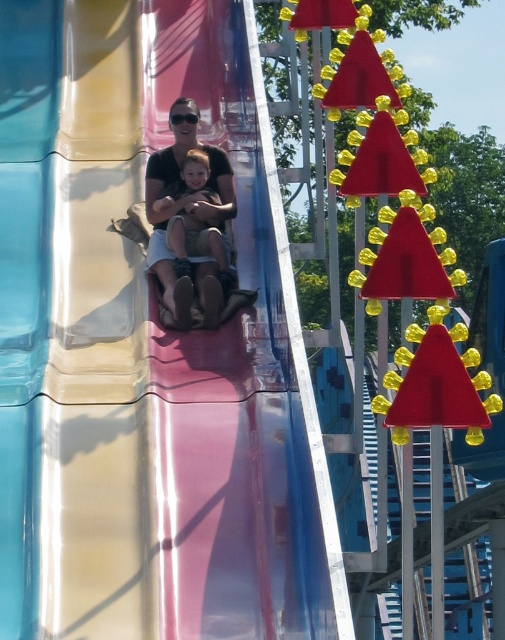
Question: Is translucent plastic slide at center behind black plastic goggles at center?

Choices:
 (A) no
 (B) yes

Answer: (A)

Question: Which object is closer to the camera taking this photo?

Choices:
 (A) black plastic goggles at center
 (B) matte brown shorts at center
 (C) translucent plastic slide at center

Answer: (C)

Question: Considering the relative positions of matte black shirt at center and black plastic goggles at center in the image provided, where is matte black shirt at center located with respect to black plastic goggles at center?

Choices:
 (A) above
 (B) below

Answer: (B)

Question: Does matte brown shorts at center appear on the left side of black plastic goggles at center?

Choices:
 (A) yes
 (B) no

Answer: (B)

Question: Which object is farther from the camera taking this photo?

Choices:
 (A) translucent plastic slide at center
 (B) black plastic goggles at center
 (C) matte brown shorts at center
 (D) matte black shirt at center

Answer: (B)

Question: Among these points, which one is farthest from the camera?

Choices:
 (A) (167, 12)
 (B) (164, 252)
 (C) (222, 150)
 (D) (170, 122)

Answer: (A)